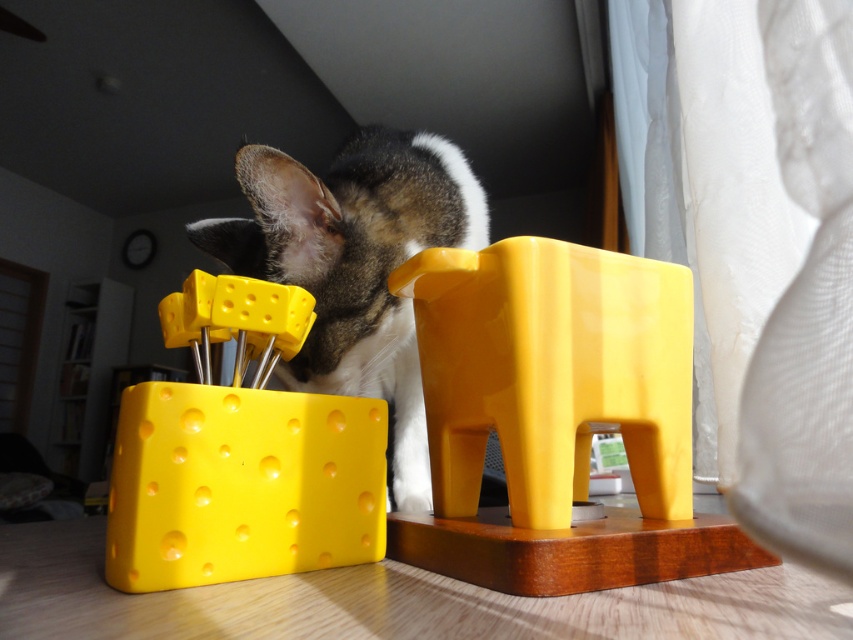
Question: Considering the real-world distances, which object is closest to the matte plastic cheese at left?

Choices:
 (A) yellow plastic elephant at center
 (B) fluffy fur cat at center

Answer: (A)

Question: Does matte plastic cheese at left appear on the left side of fluffy fur cat at center?

Choices:
 (A) no
 (B) yes

Answer: (B)

Question: Based on their relative distances, which object is farther from the yellow plastic elephant at center?

Choices:
 (A) fluffy fur cat at center
 (B) matte plastic cheese at left

Answer: (A)

Question: Does matte plastic cheese at left have a lesser width compared to fluffy fur cat at center?

Choices:
 (A) no
 (B) yes

Answer: (B)

Question: Estimate the real-world distances between objects in this image. Which object is closer to the yellow plastic elephant at center?

Choices:
 (A) fluffy fur cat at center
 (B) matte plastic cheese at left

Answer: (B)

Question: Can you confirm if yellow plastic elephant at center is smaller than matte plastic cheese at left?

Choices:
 (A) no
 (B) yes

Answer: (A)